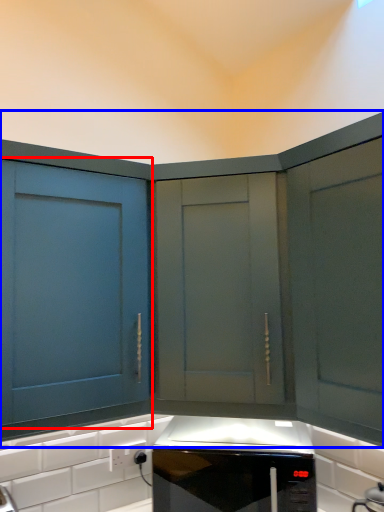
Question: Which of the following is the closest to the observer, cabinetry (highlighted by a red box) or cabinetry (highlighted by a blue box)?

Choices:
 (A) cabinetry
 (B) cabinetry

Answer: (A)